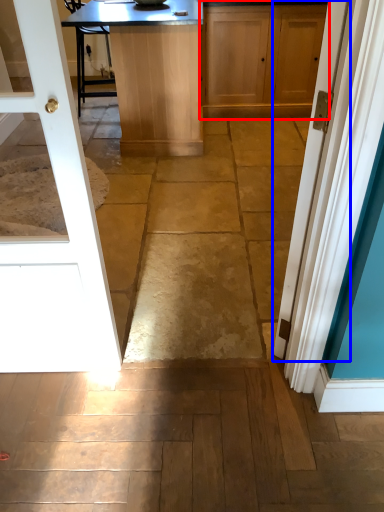
Question: Among these objects, which one is farthest to the camera, cabinetry (highlighted by a red box) or door (highlighted by a blue box)?

Choices:
 (A) cabinetry
 (B) door

Answer: (A)